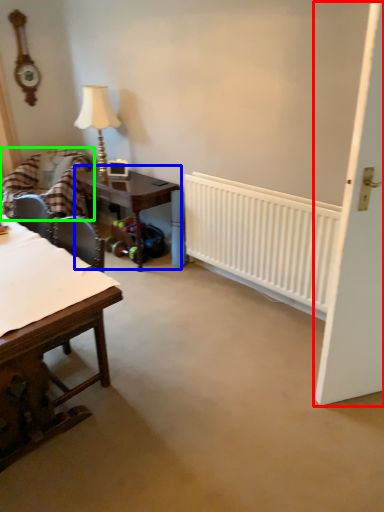
Question: Which object is the farthest from door (highlighted by a red box)? Choose among these: table (highlighted by a blue box) or chair (highlighted by a green box).

Choices:
 (A) table
 (B) chair

Answer: (B)